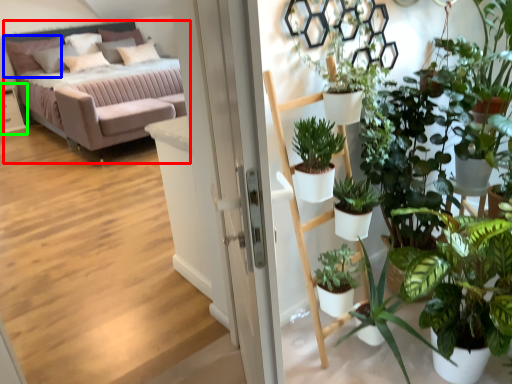
Question: Based on their relative distances, which object is farther from studio couch (highlighted by a red box)? Choose from pillow (highlighted by a blue box) and table (highlighted by a green box).

Choices:
 (A) pillow
 (B) table

Answer: (B)